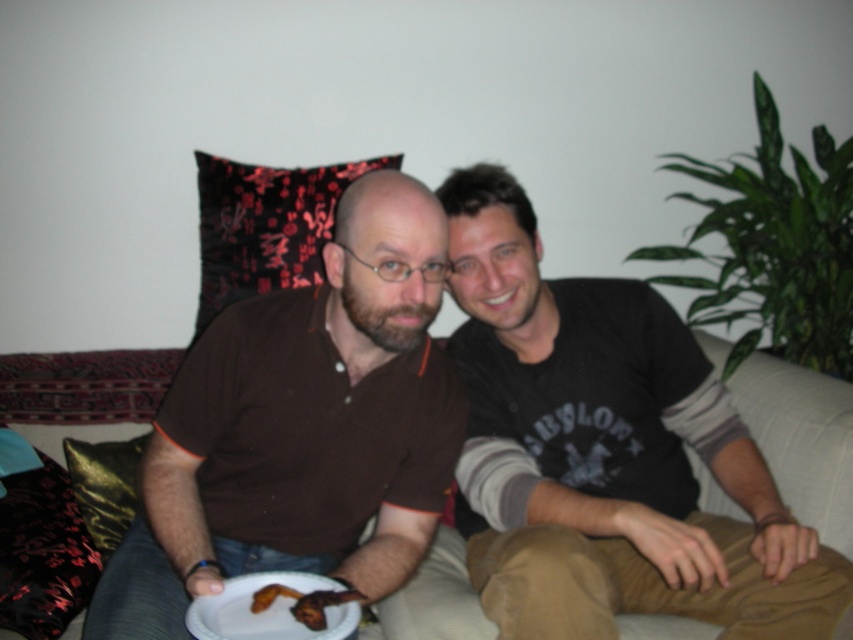
You are a photographer standing in front of the couch. You need to capture a closeup shot of the gold shiny pillow at lower left without including the brown cotton shirt at center in the frame. Is this possible based on their positions?

The brown cotton shirt at center is positioned over the gold shiny pillow at lower left, so it is blocking the view of the pillow. Therefore, capturing a closeup of the gold shiny pillow at lower left without the brown cotton shirt at center would not be possible as the shirt is covering the pillow.

You are a delivery person who just arrived at the apartment and see the white paper plate at lower center and the gold shiny pillow at lower left on the couch. You need to place a new package that is 12 inches wide. Which object should you move to make space?

The white paper plate at lower center has a smaller size compared to the gold shiny pillow at lower left, so you should move the white paper plate at lower center to make space for the package since it takes up less area.

You are a delivery robot with a package that is 24 inches long. You need to place it between the white paper plate at lower center and the gold shiny pillow at lower left on the couch. Can you fit the package between them?

The distance between the white paper plate at lower center and the gold shiny pillow at lower left is 22.62 inches. Since the package is 24 inches long, it cannot fit between them as the space is shorter than the package.